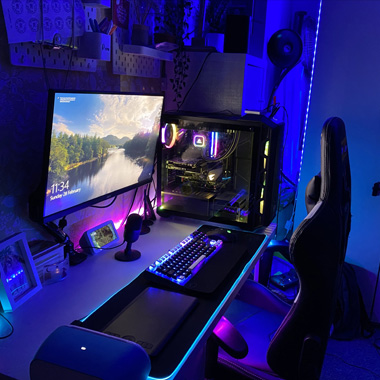
Locate an element on the screen. bottom left corner of monitor is located at coordinates (47, 216).